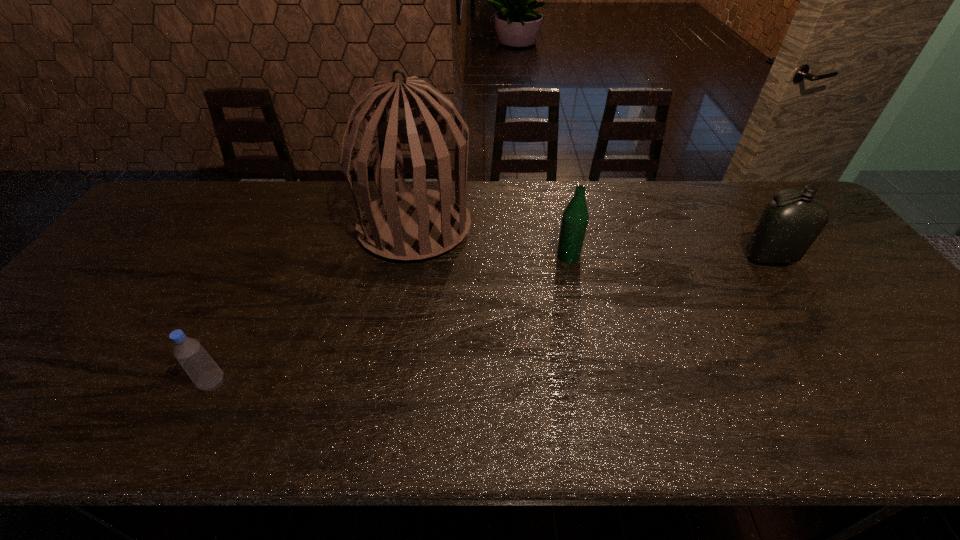
Locate an element on the screen. The width and height of the screenshot is (960, 540). vacant space that's between the tallest object and the second object from right to left is located at coordinates (492, 241).

This screenshot has width=960, height=540. Identify the location of free space between the rightmost bottle and the second bottle from right to left. (669, 257).

The image size is (960, 540). Identify the location of vacant space that is in between the rightmost bottle and the birdcage. (592, 242).

At what (x,y) coordinates should I click in order to perform the action: click on free spot between the nearest bottle and the third object from left to right. Please return your answer as a coordinate pair (x, y). The height and width of the screenshot is (540, 960). Looking at the image, I should click on (391, 320).

Find the location of `free spot between the shortest object and the birdcage`. free spot between the shortest object and the birdcage is located at coordinates (314, 305).

This screenshot has height=540, width=960. In order to click on object that can be found as the closest to the rightmost bottle in this screenshot , I will do `click(575, 217)`.

Locate an element on the screen. object that stands as the closest to the rightmost bottle is located at coordinates (575, 217).

Point out which bottle is positioned as the nearest to the tallest object. Please provide its 2D coordinates. Your answer should be formatted as a tuple, i.e. [(x, y)], where the tuple contains the x and y coordinates of a point satisfying the conditions above.

[(575, 217)]

The height and width of the screenshot is (540, 960). In order to click on the second closest bottle relative to the tallest object in this screenshot , I will do `click(204, 372)`.

This screenshot has width=960, height=540. I want to click on vacant position in the image that satisfies the following two spatial constraints: 1. on the back side of the shortest object; 2. on the right side of the third object from left to right, so click(275, 256).